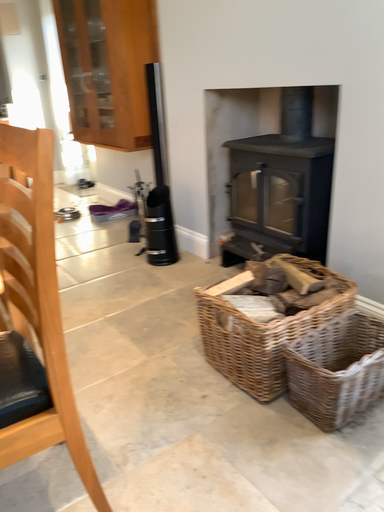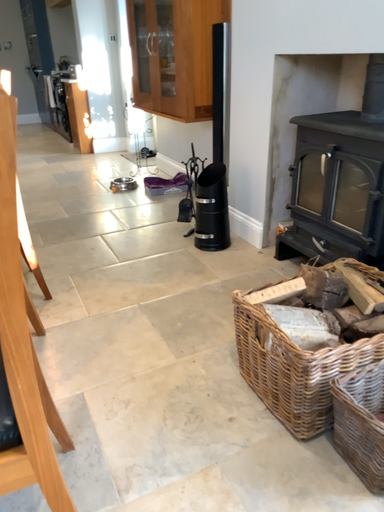
Question: How did the camera likely rotate when shooting the video?

Choices:
 (A) rotated right
 (B) rotated left

Answer: (B)